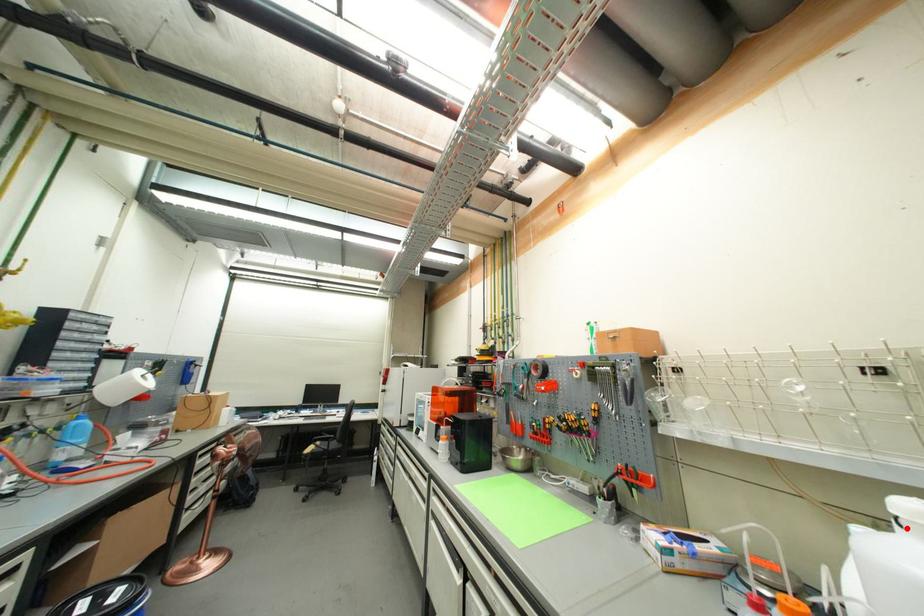
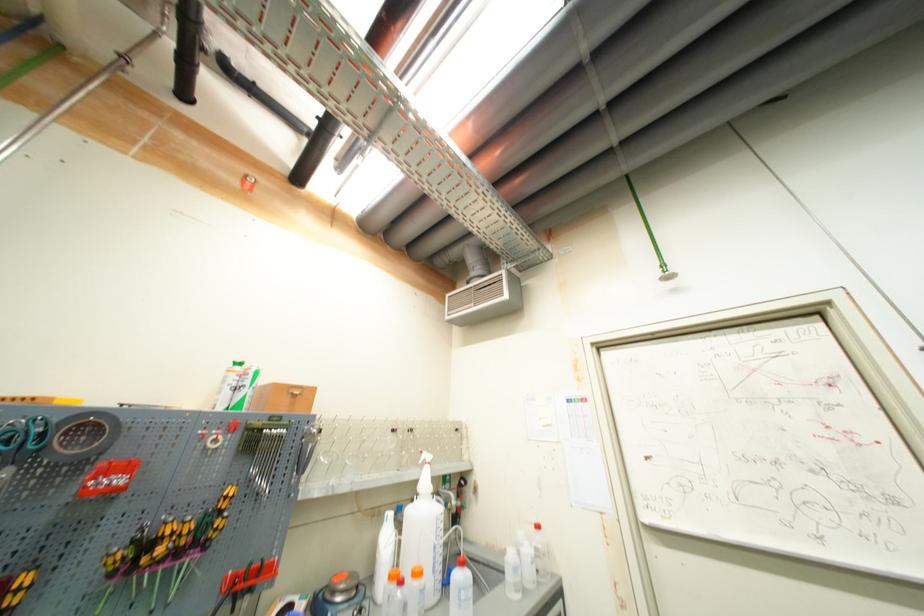
Find the pixel in the second image that matches the highlighted location in the first image.

(420, 501)